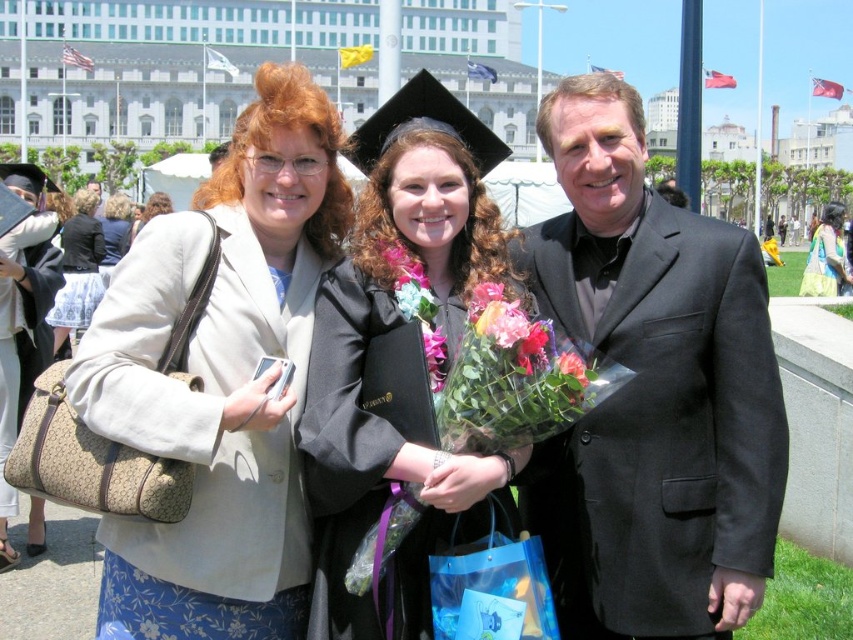
Question: Can you confirm if black suit at center is positioned to the left of vibrant floral bouquet at center?

Choices:
 (A) no
 (B) yes

Answer: (A)

Question: Which point is closer to the camera taking this photo?

Choices:
 (A) (53, 324)
 (B) (834, 292)
 (C) (583, 378)
 (D) (209, 406)

Answer: (D)

Question: In this image, where is vibrant floral bouquet at center located relative to green floral dress at center?

Choices:
 (A) below
 (B) above

Answer: (A)

Question: Among these points, which one is farthest from the camera?

Choices:
 (A) (809, 260)
 (B) (643, 342)

Answer: (A)

Question: Which of the following is the closest to the observer?

Choices:
 (A) floral lei at center
 (B) fluffy silk bouquet at center
 (C) light beige fabric purse at left

Answer: (B)

Question: Does black suit at center have a larger size compared to fluffy silk bouquet at center?

Choices:
 (A) no
 (B) yes

Answer: (B)